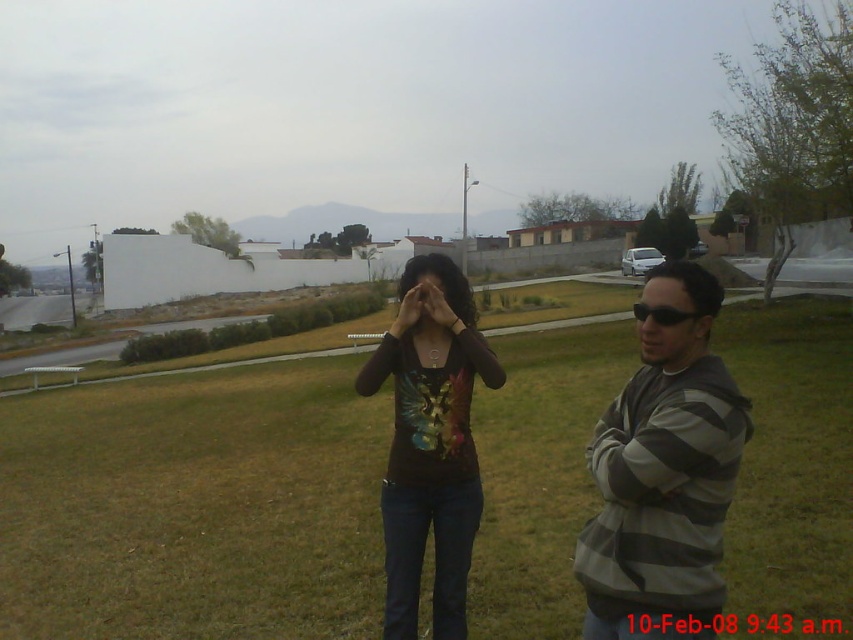
You are standing in the grassy area and want to walk from point (453, 524) to point (651, 337). Which direction should you face to move towards the point that is closer to you?

Point (453, 524) is further to the viewer than point (651, 337), so you should face away from the direction of the closer point (651, 337) to move towards the farther point (453, 524). Wait, this seems conflicting. Let me rephrase. Since you want to go from the further point to the closer one, you should face towards the direction of point (651, 337).

You are a photographer trying to capture a closeup of the shiny multicolored shirt at center and the black plastic sunglasses at center. Since you want to focus on the shirt, which object should you move closer to the camera?

The shiny multicolored shirt at center is to the left of black plastic sunglasses at center. To focus on the shirt, move the shiny multicolored shirt at center closer to the camera.

Please provide the 2D coordinates of the shiny multicolored shirt at center in the image. The scene shows two people outdoors with a residential background, a road, and distant mountains. The person on the left has their hands over their face, and the one on the right wears a striped hoodie and sunglasses with arms crossed. The timestamp is not visible in the image.

The shiny multicolored shirt at center is located at coordinates 0.692 in the x axis and 0.505 in the y axis.